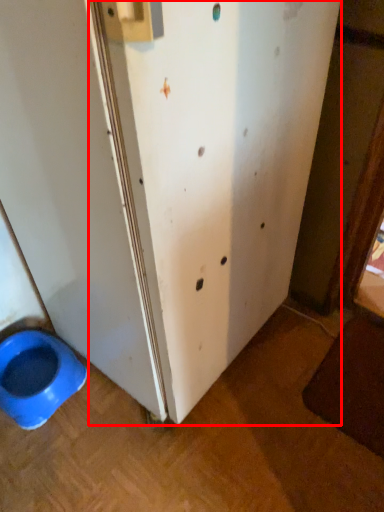
Question: From the image, what is the correct spatial relationship of screen door (annotated by the red box) in relation to toilet?

Choices:
 (A) right
 (B) left

Answer: (A)